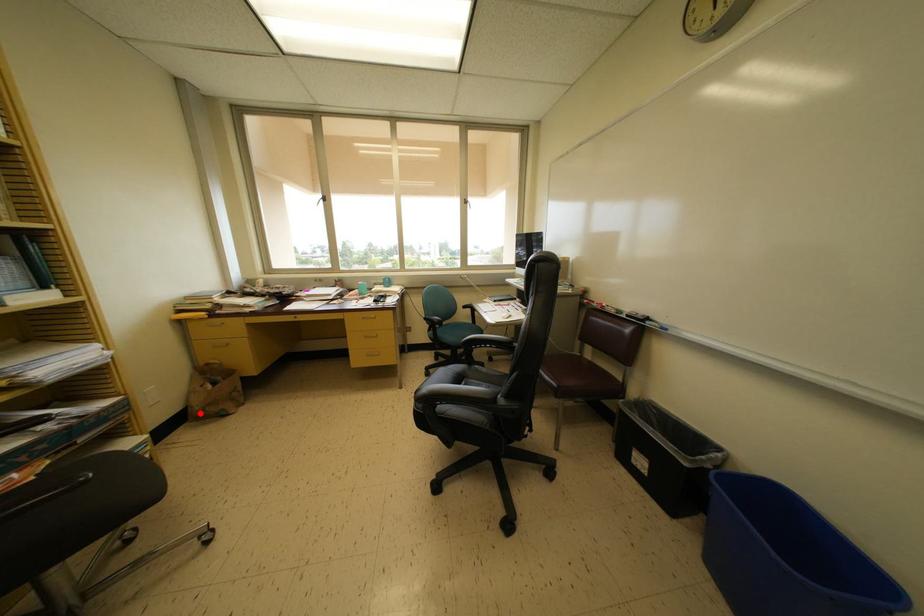
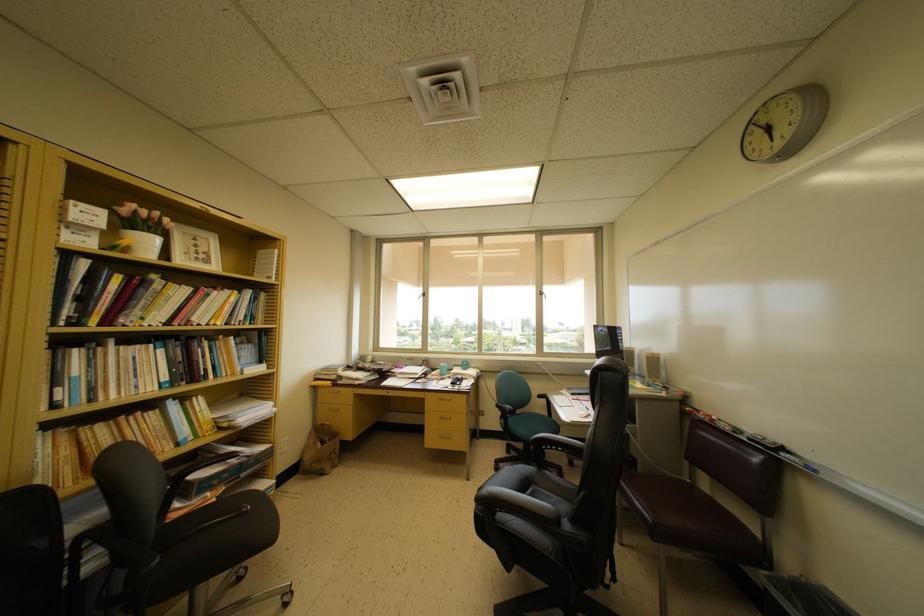
Find the pixel in the second image that matches the highlighted location in the first image.

(310, 468)